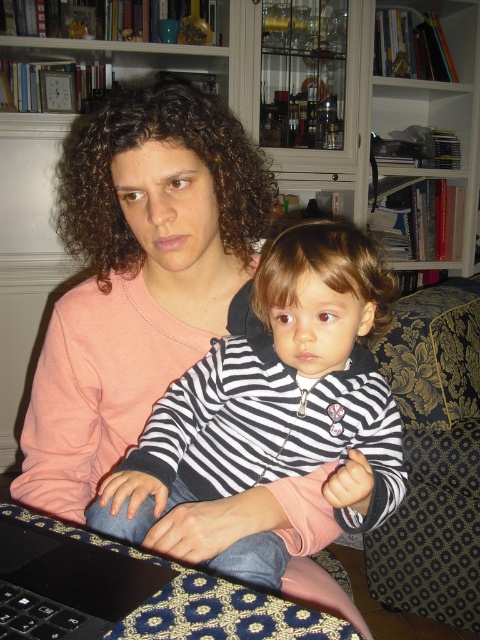
Which is above, striped fabric baby at center or black rubberized keyboard at lower left?

striped fabric baby at center is higher up.

Between striped fabric baby at center and black rubberized keyboard at lower left, which one has more height?

With more height is striped fabric baby at center.

The width and height of the screenshot is (480, 640). Find the location of `striped fabric baby at center`. striped fabric baby at center is located at coordinates (276, 396).

Locate an element on the screen. The image size is (480, 640). striped fabric baby at center is located at coordinates (276, 396).

In the scene shown: Between pink matte sweater at center and black matte laptop at lower left, which one appears on the right side from the viewer's perspective?

Positioned to the right is black matte laptop at lower left.

Measure the distance from pink matte sweater at center to black matte laptop at lower left.

pink matte sweater at center is 38.04 centimeters away from black matte laptop at lower left.

Which is in front, point (43, 500) or point (80, 598)?

Point (80, 598) is more forward.

In order to click on pink matte sweater at center in this screenshot , I will do `click(137, 275)`.

Which is more to the right, black matte laptop at lower left or black rubberized keyboard at lower left?

From the viewer's perspective, black matte laptop at lower left appears more on the right side.

Between black matte laptop at lower left and black rubberized keyboard at lower left, which one has more height?

black matte laptop at lower left is taller.

Image resolution: width=480 pixels, height=640 pixels. I want to click on black matte laptop at lower left, so click(x=67, y=584).